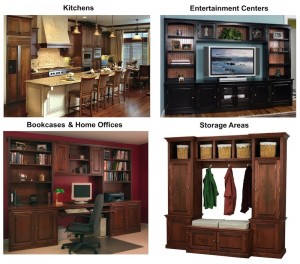
Locate an element on the screen. This screenshot has height=264, width=300. breakfast counter is located at coordinates (52, 81).